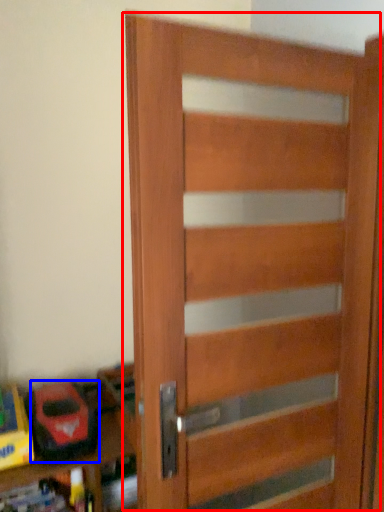
Question: Among these objects, which one is nearest to the camera, door (highlighted by a red box) or toy (highlighted by a blue box)?

Choices:
 (A) door
 (B) toy

Answer: (A)